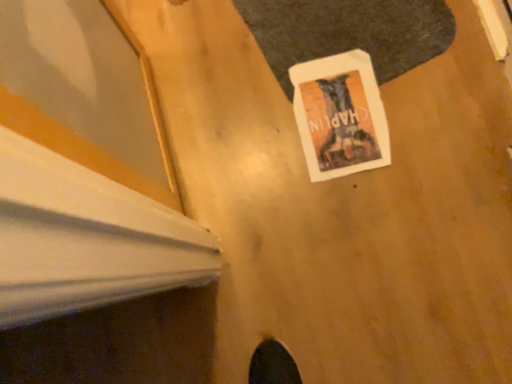
At what (x,y) coordinates should I click in order to perform the action: click on white paper at center. Please return your answer as a coordinate pair (x, y). Image resolution: width=512 pixels, height=384 pixels. Looking at the image, I should click on (349, 32).

Measure the distance between point (388,6) and camera.

1.08 meters.

What do you see at coordinates (349, 32) in the screenshot? I see `white paper at center` at bounding box center [349, 32].

At what (x,y) coordinates should I click in order to perform the action: click on white paper at center. Please return your answer as a coordinate pair (x, y). The width and height of the screenshot is (512, 384). Looking at the image, I should click on (340, 115).

The height and width of the screenshot is (384, 512). Describe the element at coordinates (340, 115) in the screenshot. I see `white paper at center` at that location.

Measure the distance between point (331, 150) and camera.

Point (331, 150) is 3.39 feet from camera.

Where is `white paper at center`? white paper at center is located at coordinates (349, 32).

Which object is positioned more to the right, white paper at center or white paper at center?

From the viewer's perspective, white paper at center appears more on the right side.

Looking at this image, is white paper at center positioned in front of white paper at center?

That is False.

Considering the points (349, 155) and (357, 19), which point is behind, point (349, 155) or point (357, 19)?

The point (357, 19) is behind.

From the image's perspective, is white paper at center under white paper at center?

Yes, from the image's perspective, white paper at center is beneath white paper at center.

Consider the image. From a real-world perspective, is white paper at center on top of white paper at center?

No, from a real-world perspective, white paper at center is not over white paper at center

Considering the relative sizes of white paper at center and white paper at center in the image provided, is white paper at center thinner than white paper at center?

Correct, the width of white paper at center is less than that of white paper at center.

Which of these two, white paper at center or white paper at center, stands taller?

white paper at center.

Considering the relative sizes of white paper at center and white paper at center in the image provided, is white paper at center smaller than white paper at center?

Correct, white paper at center occupies less space than white paper at center.

Is white paper at center inside the boundaries of white paper at center, or outside?

white paper at center is located inside white paper at center.

Is white paper at center directly adjacent to white paper at center?

white paper at center and white paper at center are clearly separated.

Could you tell me if white paper at center is facing white paper at center?

Yes, white paper at center is turned towards white paper at center.

This screenshot has width=512, height=384. In the image, there is a white paper at center. Find the location of `poster page below it (from the image's perspective)`. poster page below it (from the image's perspective) is located at coordinates (340, 115).

Considering the relative positions of white paper at center and white paper at center in the image provided, is white paper at center to the right of white paper at center from the viewer's perspective?

Correct, you'll find white paper at center to the right of white paper at center.

Which object is more forward, white paper at center or white paper at center?

white paper at center is in front.

Is point (376, 7) behind point (356, 166)?

Yes.

From the image's perspective, between white paper at center and white paper at center, who is located below?

white paper at center appears lower in the image.

From a real-world perspective, does white paper at center stand above white paper at center?

Correct, in the physical world, white paper at center is higher than white paper at center.

Does white paper at center have a greater width compared to white paper at center?

Indeed, white paper at center has a greater width compared to white paper at center.

Is white paper at center taller than white paper at center?

Correct, white paper at center is much taller as white paper at center.

Is white paper at center bigger than white paper at center?

Yes, white paper at center is bigger than white paper at center.

Do you think white paper at center is within white paper at center, or outside of it?

white paper at center is spatially situated outside white paper at center.

Is white paper at center next to white paper at center and touching it?

white paper at center and white paper at center are not in contact.

Is white paper at center facing away from white paper at center?

No.

This screenshot has width=512, height=384. I want to click on mat that is in front of the white paper at center, so click(349, 32).

This screenshot has height=384, width=512. Find the location of `mat above the white paper at center (from the image's perspective)`. mat above the white paper at center (from the image's perspective) is located at coordinates click(x=349, y=32).

Where is `poster page located on the left of white paper at center`? poster page located on the left of white paper at center is located at coordinates (340, 115).